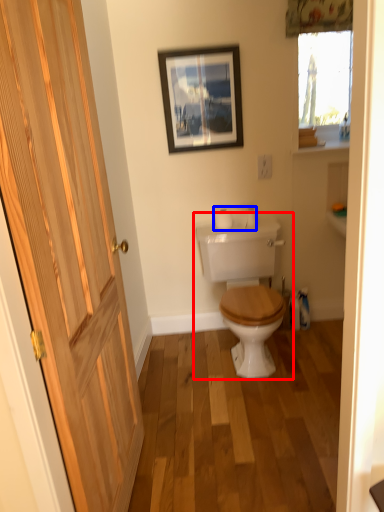
Question: Which point is closer to the camera, toilet (highlighted by a red box) or toilet paper (highlighted by a blue box)?

Choices:
 (A) toilet
 (B) toilet paper

Answer: (A)